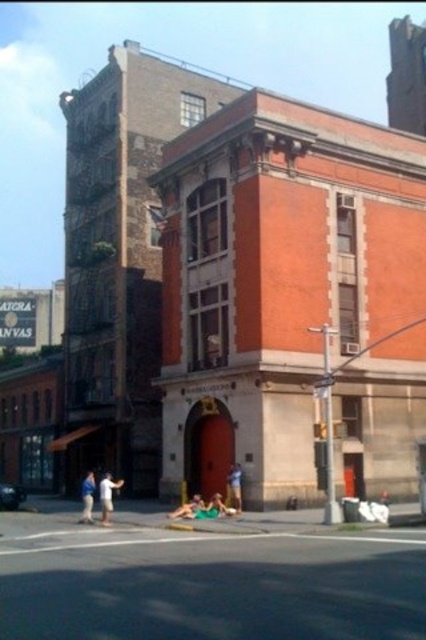
The image size is (426, 640). What do you see at coordinates (187, 508) in the screenshot?
I see `smooth skin person at lower center` at bounding box center [187, 508].

Is smooth skin person at lower center smaller than green fabric person at lower center?

Yes.

Identify the location of smooth skin person at lower center. (187, 508).

Between white cotton shirt at lower center and blue denim shorts at lower left, which one appears on the right side from the viewer's perspective?

white cotton shirt at lower center

Is point (120, 483) more distant than point (89, 474)?

That is False.

I want to click on white cotton shirt at lower center, so pyautogui.click(x=106, y=496).

Can you confirm if green fabric at lower center is wider than white cotton shirt at lower center?

Yes.

Which is in front, point (287, 557) or point (109, 490)?

Point (287, 557) is more forward.

The width and height of the screenshot is (426, 640). I want to click on green fabric at lower center, so click(210, 582).

Locate an element on the screen. This screenshot has height=640, width=426. green fabric at lower center is located at coordinates (210, 582).